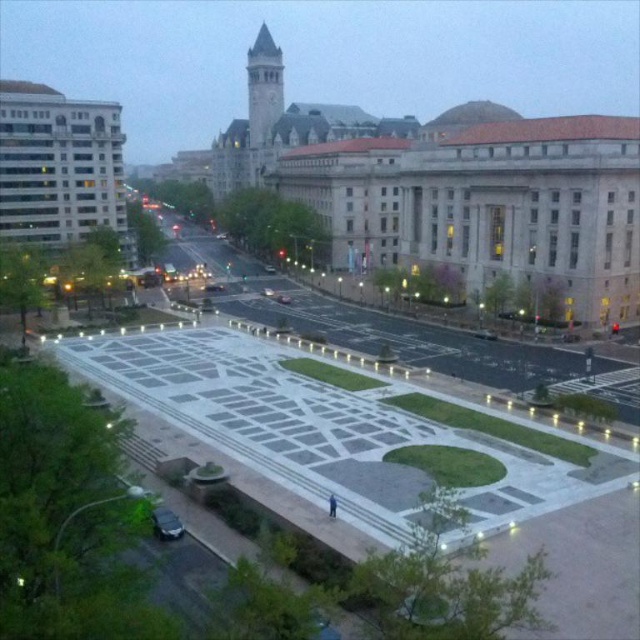
Does gray stone clock tower at upper center have a larger size compared to shiny black sedan at lower left?

Yes, gray stone clock tower at upper center is bigger than shiny black sedan at lower left.

Is gray stone clock tower at upper center to the left of shiny black sedan at lower left from the viewer's perspective?

Correct, you'll find gray stone clock tower at upper center to the left of shiny black sedan at lower left.

Who is more distant from viewer, [268,60] or [152,522]?

Point [268,60]

This screenshot has width=640, height=640. In order to click on gray stone clock tower at upper center in this screenshot , I will do `click(262, 86)`.